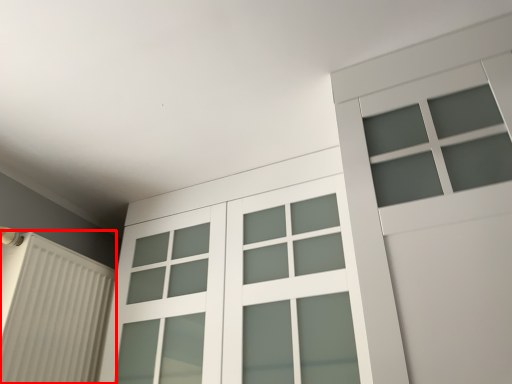
Question: Where is shutter (annotated by the red box) located in relation to glass door in the image?

Choices:
 (A) right
 (B) left

Answer: (B)